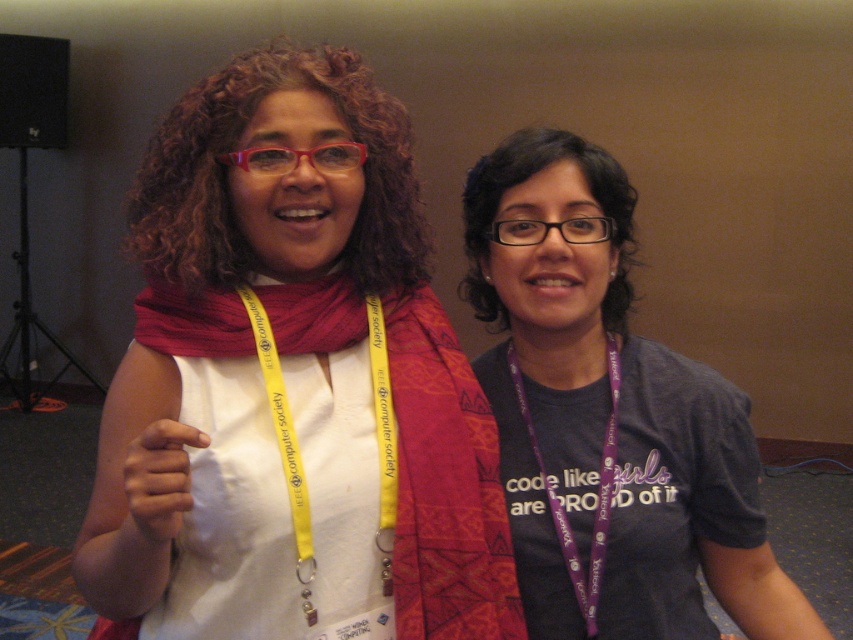
Question: Which of the following is the farthest from the observer?

Choices:
 (A) (544, 330)
 (B) (263, 273)

Answer: (A)

Question: Does yellow fabric lanyard at center have a larger size compared to matte red scarf at center?

Choices:
 (A) yes
 (B) no

Answer: (A)

Question: Which object is closer to the camera taking this photo?

Choices:
 (A) matte red scarf at center
 (B) purple lanyard at center

Answer: (A)

Question: Which point is farther to the camera?

Choices:
 (A) (332, 154)
 (B) (540, 204)
 (C) (268, 456)

Answer: (B)

Question: Is yellow fabric lanyard at center to the left of matte red scarf at center from the viewer's perspective?

Choices:
 (A) yes
 (B) no

Answer: (B)

Question: Is matte white scarf at center thinner than purple lanyard at center?

Choices:
 (A) yes
 (B) no

Answer: (B)